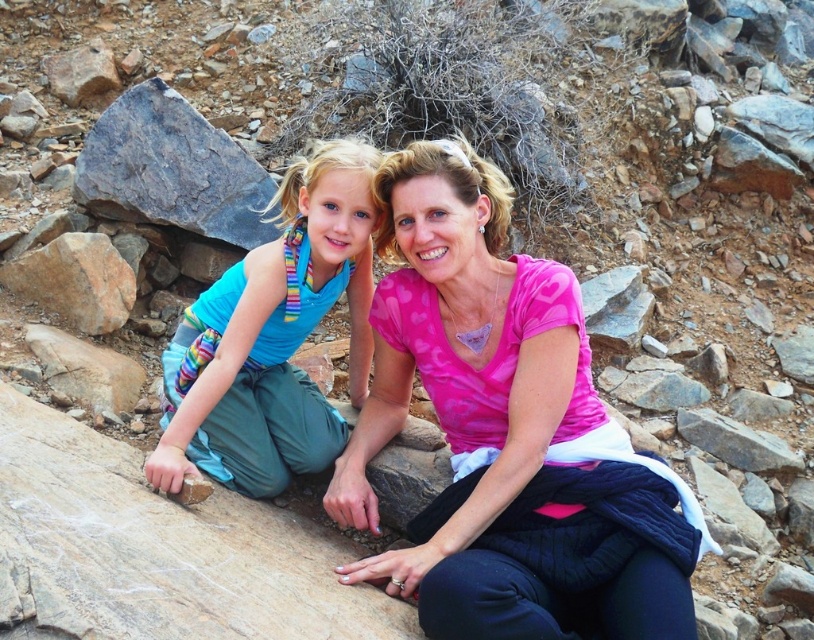
Question: Does pink fabric at center come behind gray rough boulder at upper left?

Choices:
 (A) yes
 (B) no

Answer: (B)

Question: In this image, where is pink fabric at center located relative to gray rough boulder at upper left?

Choices:
 (A) below
 (B) above

Answer: (A)

Question: Is blue fabric at center positioned behind gray rough boulder at upper left?

Choices:
 (A) no
 (B) yes

Answer: (A)

Question: Among these objects, which one is nearest to the camera?

Choices:
 (A) pink fabric at center
 (B) gray rough boulder at upper left
 (C) blue fabric at center

Answer: (A)

Question: Which point is closer to the camera taking this photo?

Choices:
 (A) (392, 580)
 (B) (344, 221)

Answer: (A)

Question: Which of the following is the closest to the observer?

Choices:
 (A) coord(527,436)
 (B) coord(291,259)
 (C) coord(155,132)

Answer: (A)